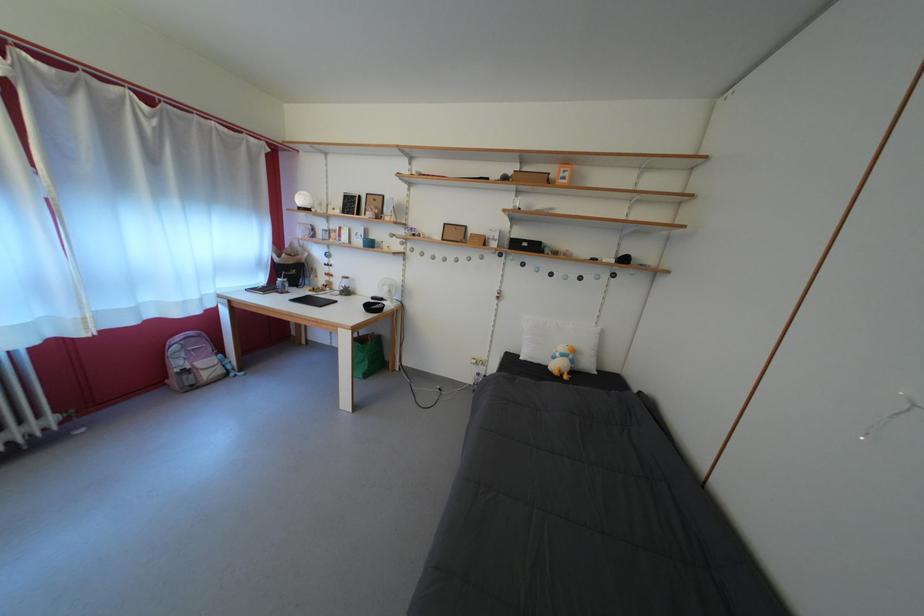
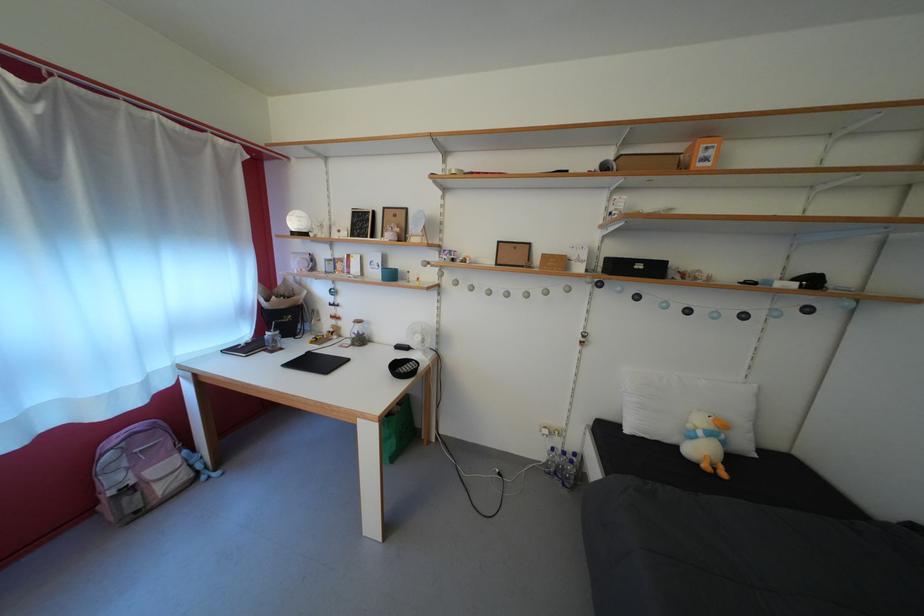
The point at (x=580, y=368) is marked in the first image. Where is the corresponding point in the second image?

(732, 448)